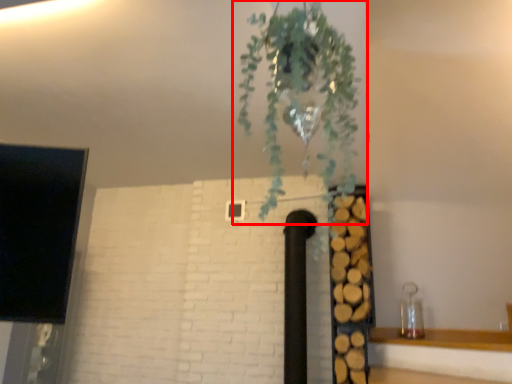
Question: From the image, what is the correct spatial relationship of houseplant (annotated by the red box) in relation to shelf?

Choices:
 (A) left
 (B) right

Answer: (A)